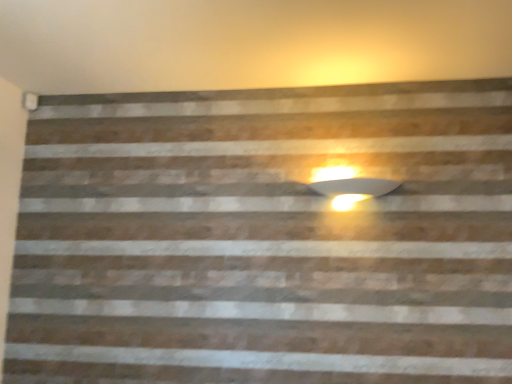
Locate an element on the screen. The image size is (512, 384). white glossy lampshade at center is located at coordinates (348, 186).

What do you see at coordinates (348, 186) in the screenshot? I see `white glossy lampshade at center` at bounding box center [348, 186].

Measure the distance between white glossy lampshade at center and camera.

6.91 feet.

At what (x,y) coordinates should I click in order to perform the action: click on white glossy lampshade at center. Please return your answer as a coordinate pair (x, y). This screenshot has width=512, height=384. Looking at the image, I should click on (348, 186).